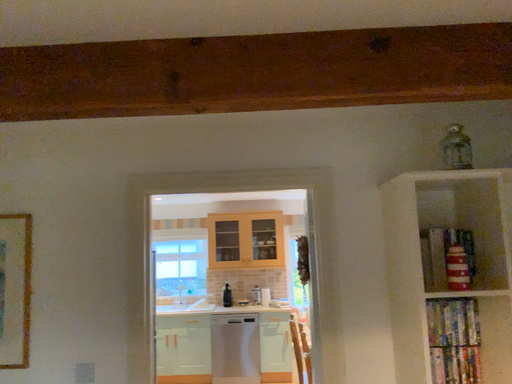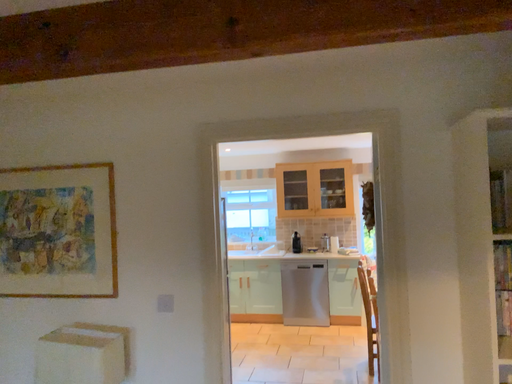
Question: Which way did the camera rotate in the video?

Choices:
 (A) rotated left
 (B) rotated right

Answer: (A)